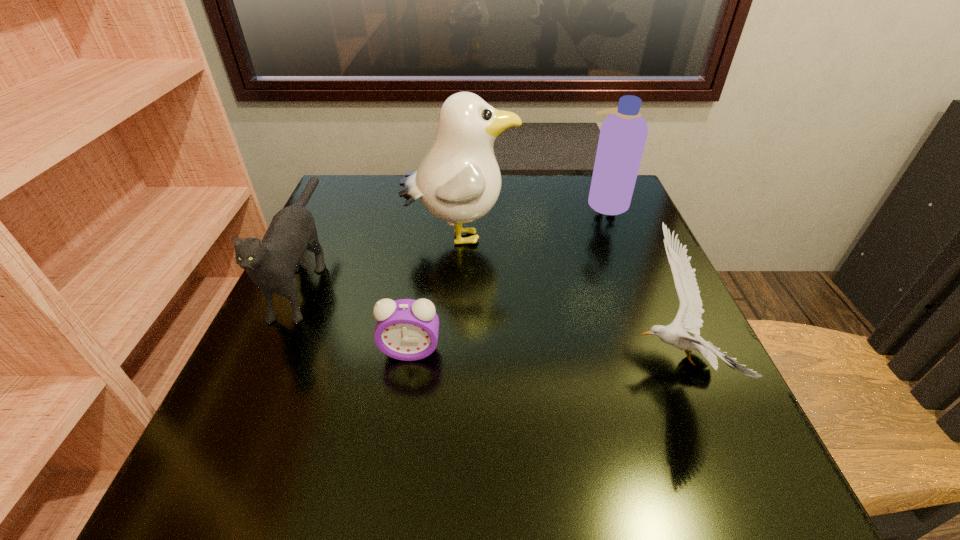
Identify the location of vacant space that satisfies the following two spatial constraints: 1. on the beak of the tallest object; 2. on the front-facing side of the leftmost object. pyautogui.click(x=458, y=273).